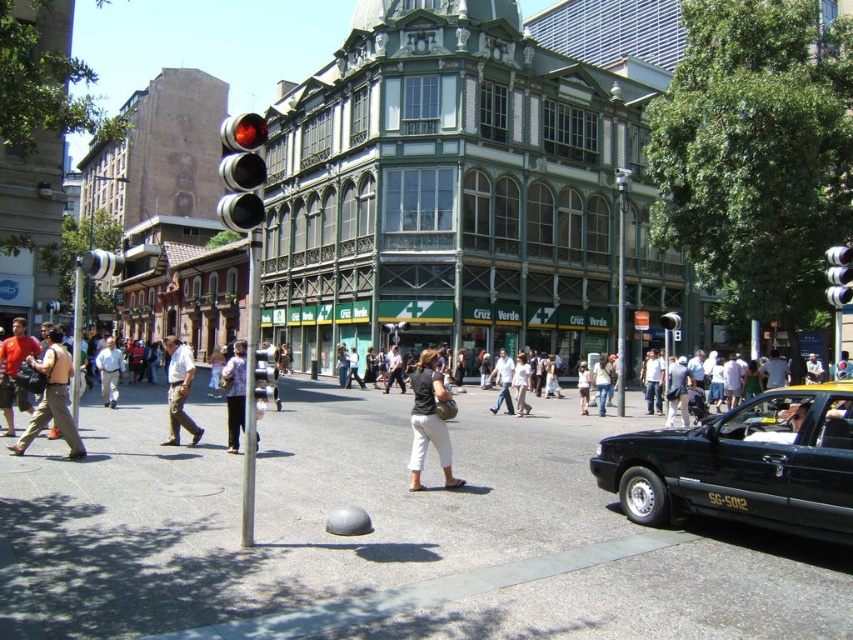
Question: Does khaki pants at center have a lesser width compared to white cotton shirt at center?

Choices:
 (A) yes
 (B) no

Answer: (B)

Question: Does metallic pole at center have a smaller size compared to white cotton shirt at center?

Choices:
 (A) yes
 (B) no

Answer: (B)

Question: Among these points, which one is farthest from the camera?

Choices:
 (A) (175, 378)
 (B) (222, 378)
 (C) (42, 396)
 (D) (250, 182)

Answer: (A)

Question: Which of these objects is positioned closest to the light brown leather jacket at center?

Choices:
 (A) black glossy taxi at lower right
 (B) matte red shirt at left

Answer: (B)

Question: Does metallic silver traffic light at upper right have a larger size compared to light brown leather jacket at center?

Choices:
 (A) no
 (B) yes

Answer: (A)

Question: Which of the following is the farthest from the observer?

Choices:
 (A) (238, 129)
 (B) (450, 451)
 (C) (73, 268)

Answer: (C)